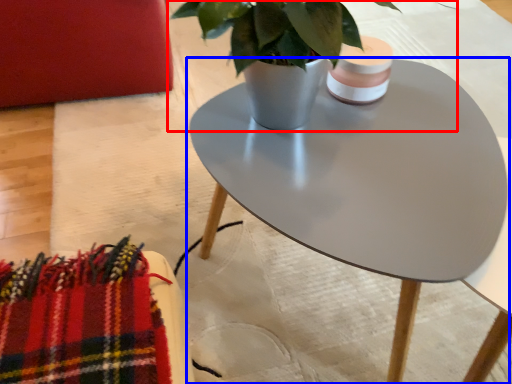
Question: Which object is further to the camera taking this photo, houseplant (highlighted by a red box) or coffee table (highlighted by a blue box)?

Choices:
 (A) houseplant
 (B) coffee table

Answer: (B)